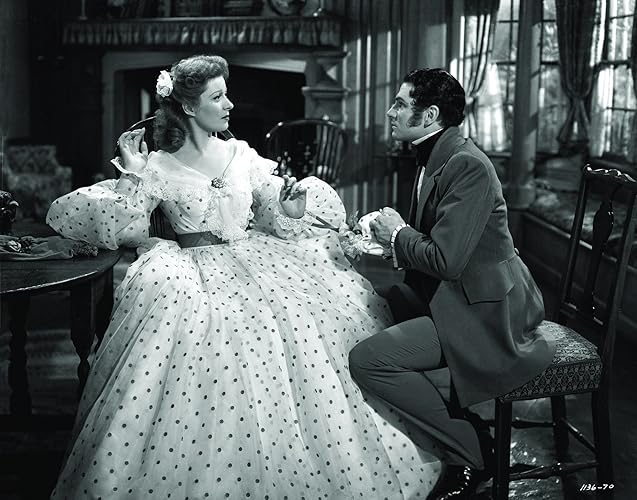
At what (x,y) coordinates should I click in order to perform the action: click on place to sit. Please return your answer as a coordinate pair (x, y). Looking at the image, I should click on (568, 361).